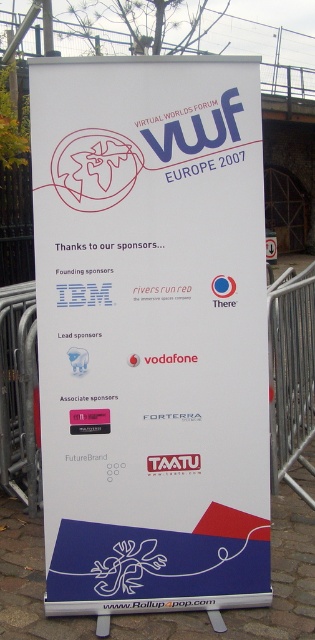
You are setting up for an event and need to place a 3m wide equipment stand. You have two metal pieces available, the metal barricade at right and the metal at upper center. Based on the banner, which metal piece can accommodate the equipment stand?

The metal barricade at right has a larger width than the metal at upper center, so the equipment stand can be placed on the metal barricade at right.

You are at the entrance of a conference hall and see the white paper sign at center and the metal at upper center on the promotional banner. Which object takes up more space on the banner?

The white paper sign at center has a larger size compared to metal at upper center, so it takes up more space on the banner.